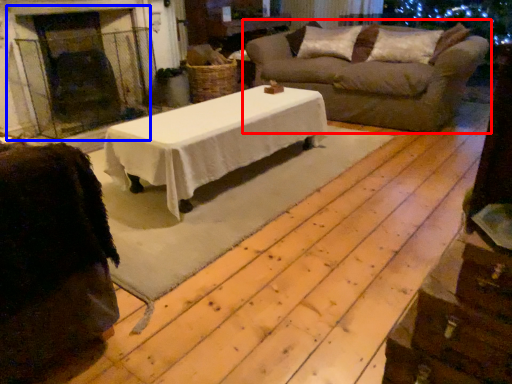
Question: Among these objects, which one is nearest to the camera, studio sofa (highlighted by a red box) or fireplace (highlighted by a blue box)?

Choices:
 (A) studio sofa
 (B) fireplace

Answer: (A)